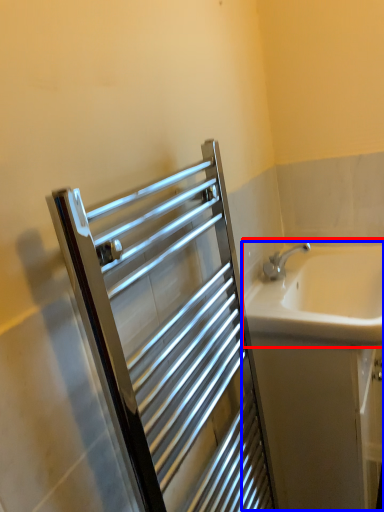
Question: Which object appears closest to the camera in this image, sink (highlighted by a red box) or bath (highlighted by a blue box)?

Choices:
 (A) sink
 (B) bath

Answer: (A)